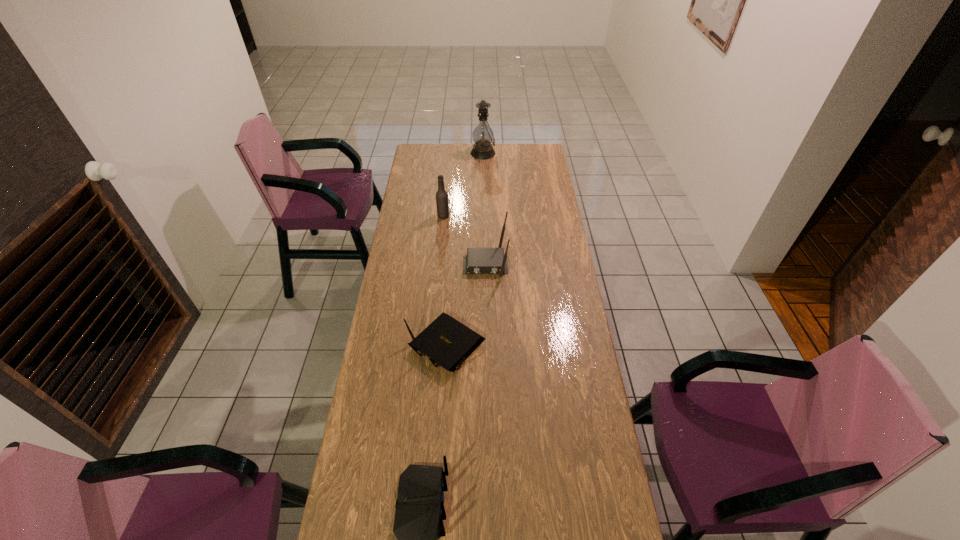
The height and width of the screenshot is (540, 960). Find the location of `oil lamp`. oil lamp is located at coordinates (483, 136).

Where is `the tallest object`? The image size is (960, 540). the tallest object is located at coordinates (483, 136).

Where is `the fourth nearest object`? Image resolution: width=960 pixels, height=540 pixels. the fourth nearest object is located at coordinates (442, 204).

Find the location of a particular element. This screenshot has height=540, width=960. the third nearest object is located at coordinates (478, 260).

At what (x,y) coordinates should I click in order to perform the action: click on the tallest router. Please return your answer as a coordinate pair (x, y). This screenshot has width=960, height=540. Looking at the image, I should click on (478, 260).

This screenshot has height=540, width=960. Find the location of `the second farthest router`. the second farthest router is located at coordinates (447, 342).

The height and width of the screenshot is (540, 960). What are the coordinates of `the shortest object` in the screenshot? It's located at (447, 342).

Find the location of a particular element. free space located on the left of the farthest object is located at coordinates (438, 153).

The width and height of the screenshot is (960, 540). What are the coordinates of `free space located on the side of the beer bottle with the label` in the screenshot? It's located at (484, 216).

Where is `free space located on the back of the third farthest object to connect cables`? The image size is (960, 540). free space located on the back of the third farthest object to connect cables is located at coordinates (486, 324).